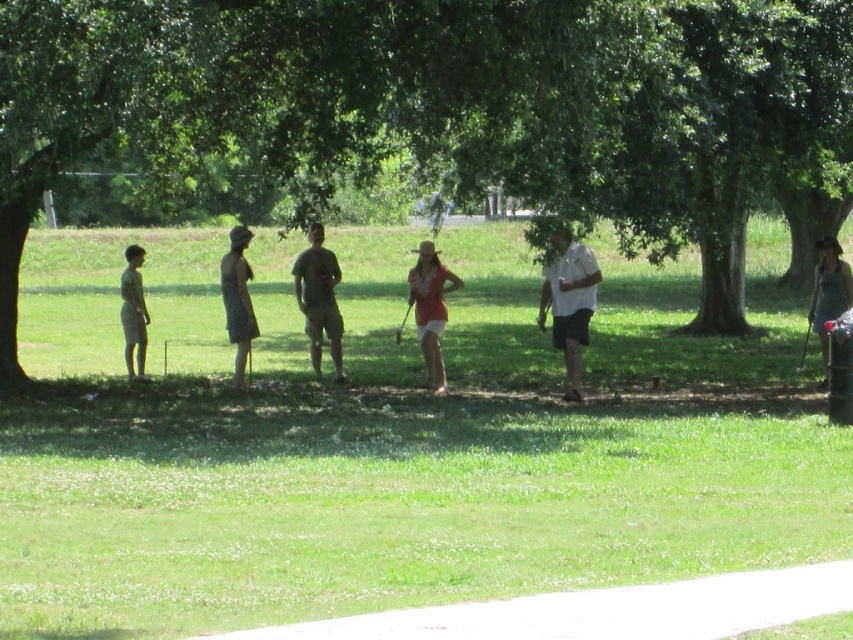
Question: Is green leafy tree at center above pink fabric dress at center?

Choices:
 (A) yes
 (B) no

Answer: (A)

Question: Can you confirm if green grass at center is bigger than denim dress at right?

Choices:
 (A) yes
 (B) no

Answer: (A)

Question: Which point is farther to the camera?

Choices:
 (A) (460, 268)
 (B) (140, 365)

Answer: (A)

Question: Is green leafy tree at center to the right of light brown shorts at left from the viewer's perspective?

Choices:
 (A) no
 (B) yes

Answer: (B)

Question: Which object is positioned farthest from the green grass at center?

Choices:
 (A) green leafy tree at center
 (B) denim shorts at center
 (C) pink fabric dress at center
 (D) denim dress at right

Answer: (C)

Question: Among these objects, which one is farthest from the camera?

Choices:
 (A) denim dress at right
 (B) camouflage t-shirt at center
 (C) denim shorts at center

Answer: (B)